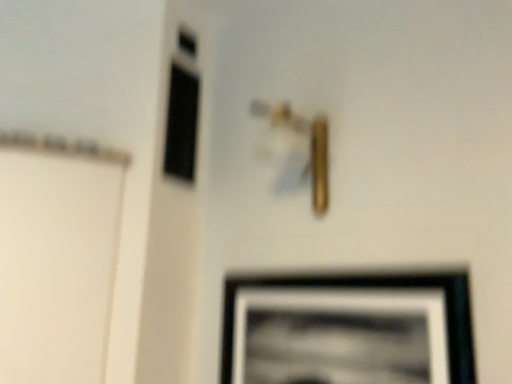
Question: Is black glass window at upper left in front of gold metallic door handle at center?

Choices:
 (A) no
 (B) yes

Answer: (A)

Question: Considering the relative sizes of black glass window at upper left and gold metallic door handle at center in the image provided, is black glass window at upper left shorter than gold metallic door handle at center?

Choices:
 (A) no
 (B) yes

Answer: (A)

Question: Can you confirm if black glass window at upper left is positioned to the right of gold metallic door handle at center?

Choices:
 (A) yes
 (B) no

Answer: (B)

Question: Could you tell me if black glass window at upper left is facing gold metallic door handle at center?

Choices:
 (A) yes
 (B) no

Answer: (A)

Question: Is black glass window at upper left next to gold metallic door handle at center?

Choices:
 (A) no
 (B) yes

Answer: (A)

Question: Which is correct: black matte picture frame at lower right is inside gold metallic door handle at center, or outside of it?

Choices:
 (A) inside
 (B) outside

Answer: (B)

Question: Looking at the image, does black matte picture frame at lower right seem bigger or smaller compared to gold metallic door handle at center?

Choices:
 (A) big
 (B) small

Answer: (B)

Question: Relative to gold metallic door handle at center, is black matte picture frame at lower right in front or behind?

Choices:
 (A) behind
 (B) front

Answer: (B)

Question: From a real-world perspective, is black matte picture frame at lower right above or below gold metallic door handle at center?

Choices:
 (A) above
 (B) below

Answer: (B)

Question: From a real-world perspective, is gold metallic door handle at center physically located above or below black glass window at upper left?

Choices:
 (A) above
 (B) below

Answer: (B)

Question: In terms of width, does gold metallic door handle at center look wider or thinner when compared to black glass window at upper left?

Choices:
 (A) wide
 (B) thin

Answer: (A)

Question: Is gold metallic door handle at center to the left or to the right of black glass window at upper left in the image?

Choices:
 (A) left
 (B) right

Answer: (B)

Question: From the image's perspective, relative to black glass window at upper left, is gold metallic door handle at center above or below?

Choices:
 (A) above
 (B) below

Answer: (B)

Question: Does point (268, 382) appear closer or farther from the camera than point (180, 125)?

Choices:
 (A) farther
 (B) closer

Answer: (B)

Question: Based on their sizes in the image, would you say black matte picture frame at lower right is bigger or smaller than black glass window at upper left?

Choices:
 (A) big
 (B) small

Answer: (A)